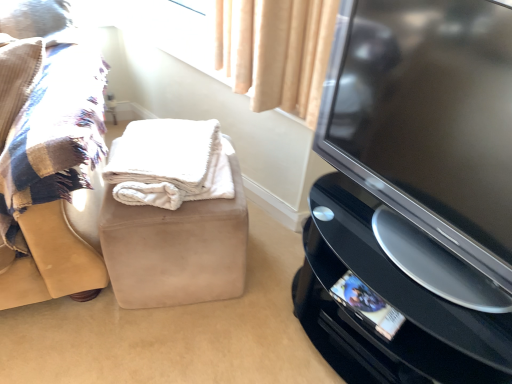
What is the approximate height of plaid fabric cushion at left, which ranks as the second furniture in right-to-left order?

It is 21.72 inches.

This screenshot has width=512, height=384. Describe the element at coordinates (173, 215) in the screenshot. I see `beige suede ottoman at center, which ranks as the 1th furniture in right-to-left order` at that location.

Locate an element on the screen. black glossy tv at right is located at coordinates (429, 136).

Locate an element on the screen. white fluffy blanket at center is located at coordinates (169, 163).

Locate an element on the screen. plaid fabric cushion at left, which ranks as the second furniture in right-to-left order is located at coordinates (47, 152).

Considering the sizes of objects beige suede ottoman at center, which ranks as the 1th furniture in right-to-left order, and plaid fabric cushion at left, which ranks as the second furniture in right-to-left order, in the image provided, who is shorter, beige suede ottoman at center, which ranks as the 1th furniture in right-to-left order, or plaid fabric cushion at left, which ranks as the second furniture in right-to-left order,?

beige suede ottoman at center, which ranks as the 1th furniture in right-to-left order.

Which is correct: beige suede ottoman at center, which ranks as the 1th furniture in right-to-left order, is inside plaid fabric cushion at left, arranged as the first furniture when viewed from the left, or outside of it?

beige suede ottoman at center, which ranks as the 1th furniture in right-to-left order, is outside plaid fabric cushion at left, arranged as the first furniture when viewed from the left.

Could you tell me if beige suede ottoman at center, positioned as the second furniture in left-to-right order, is facing plaid fabric cushion at left, arranged as the first furniture when viewed from the left?

No.

Who is smaller, beige suede ottoman at center, which ranks as the 1th furniture in right-to-left order, or plaid fabric cushion at left, which ranks as the second furniture in right-to-left order?

With smaller size is plaid fabric cushion at left, which ranks as the second furniture in right-to-left order.

Relative to black glossy tv at right, is beige suede ottoman at center, positioned as the second furniture in left-to-right order, in front or behind?

Visually, beige suede ottoman at center, positioned as the second furniture in left-to-right order, is located behind black glossy tv at right.

Is beige suede ottoman at center, positioned as the second furniture in left-to-right order, shorter than black glossy tv at right?

Correct, beige suede ottoman at center, positioned as the second furniture in left-to-right order, is not as tall as black glossy tv at right.

Does beige suede ottoman at center, which ranks as the 1th furniture in right-to-left order, have a lesser width compared to black glossy tv at right?

Indeed, beige suede ottoman at center, which ranks as the 1th furniture in right-to-left order, has a lesser width compared to black glossy tv at right.

Which object is positioned more to the right, black glossy tv at right or beige suede ottoman at center, which ranks as the 1th furniture in right-to-left order?

Positioned to the right is black glossy tv at right.

From a real-world perspective, is black glossy tv at right above or below beige suede ottoman at center, positioned as the second furniture in left-to-right order?

Clearly, from a real-world perspective, black glossy tv at right is above beige suede ottoman at center, positioned as the second furniture in left-to-right order.

Does black glossy tv at right have a smaller size compared to beige suede ottoman at center, positioned as the second furniture in left-to-right order?

No.

This screenshot has width=512, height=384. I want to click on the 2nd furniture behind when counting from the black glossy tv at right, so click(x=173, y=215).

In terms of height, does plaid fabric cushion at left, which ranks as the second furniture in right-to-left order, look taller or shorter compared to black glossy tv at right?

Clearly, plaid fabric cushion at left, which ranks as the second furniture in right-to-left order, is shorter compared to black glossy tv at right.

Do you think plaid fabric cushion at left, arranged as the first furniture when viewed from the left, is within black glossy tv at right, or outside of it?

plaid fabric cushion at left, arranged as the first furniture when viewed from the left, lies outside black glossy tv at right.

Find the location of a particular element. furniture that is the 1st one when counting backward from the black glossy tv at right is located at coordinates 47,152.

Does plaid fabric cushion at left, arranged as the first furniture when viewed from the left, appear on the right side of black glossy tv at right?

Incorrect, plaid fabric cushion at left, arranged as the first furniture when viewed from the left, is not on the right side of black glossy tv at right.

Which is in front, white fluffy blanket at center or plaid fabric cushion at left, which ranks as the second furniture in right-to-left order?

plaid fabric cushion at left, which ranks as the second furniture in right-to-left order, is in front.

Can you confirm if white fluffy blanket at center is smaller than plaid fabric cushion at left, which ranks as the second furniture in right-to-left order?

Yes.

Find the location of a particular element. This screenshot has height=384, width=512. blanket behind the plaid fabric cushion at left, arranged as the first furniture when viewed from the left is located at coordinates (169, 163).

Is white fluffy blanket at center positioned far away from plaid fabric cushion at left, arranged as the first furniture when viewed from the left?

No.

From the image's perspective, is black glossy tv at right below plaid fabric cushion at left, which ranks as the second furniture in right-to-left order?

Yes.

Is black glossy tv at right not near plaid fabric cushion at left, which ranks as the second furniture in right-to-left order?

No.

In the image, is black glossy tv at right on the left side or the right side of plaid fabric cushion at left, which ranks as the second furniture in right-to-left order?

From the image, it's evident that black glossy tv at right is to the right of plaid fabric cushion at left, which ranks as the second furniture in right-to-left order.

Is black glossy tv at right not within plaid fabric cushion at left, arranged as the first furniture when viewed from the left?

Absolutely, black glossy tv at right is external to plaid fabric cushion at left, arranged as the first furniture when viewed from the left.

From the image's perspective, is black glossy tv at right above plaid fabric cushion at left, arranged as the first furniture when viewed from the left?

No.

Is black glossy tv at right far from plaid fabric cushion at left, which ranks as the second furniture in right-to-left order?

That's not correct — black glossy tv at right is a little close to plaid fabric cushion at left, which ranks as the second furniture in right-to-left order.

Is black glossy tv at right to the left or to the right of plaid fabric cushion at left, which ranks as the second furniture in right-to-left order, in the image?

Clearly, black glossy tv at right is on the right of plaid fabric cushion at left, which ranks as the second furniture in right-to-left order, in the image.

Which of these two, black glossy tv at right or plaid fabric cushion at left, arranged as the first furniture when viewed from the left, is bigger?

black glossy tv at right.

In order to click on furniture located above the beige suede ottoman at center, positioned as the second furniture in left-to-right order (from the image's perspective) in this screenshot , I will do `click(47, 152)`.

You are a GUI agent. You are given a task and a screenshot of the screen. Output one action in this format:
    pyautogui.click(x=<x>, y=<y>)
    Task: Click on the home appliance located in front of the beige suede ottoman at center, which ranks as the 1th furniture in right-to-left order
    
    Given the screenshot: What is the action you would take?
    pyautogui.click(x=385, y=305)

Looking at the image, which one is located closer to beige suede ottoman at center, positioned as the second furniture in left-to-right order, white fluffy blanket at center or plaid fabric cushion at left, arranged as the first furniture when viewed from the left?

white fluffy blanket at center lies closer to beige suede ottoman at center, positioned as the second furniture in left-to-right order, than the other object.

Estimate the real-world distances between objects in this image. Which object is further from white fluffy blanket at center, beige suede ottoman at center, positioned as the second furniture in left-to-right order, or black glossy tv at right?

The object further to white fluffy blanket at center is black glossy tv at right.

Considering their positions, is plaid fabric cushion at left, which ranks as the second furniture in right-to-left order, positioned closer to white fluffy blanket at center than black glossy tv at right?

plaid fabric cushion at left, which ranks as the second furniture in right-to-left order, is positioned closer to the anchor white fluffy blanket at center.

Estimate the real-world distances between objects in this image. Which object is closer to plaid fabric cushion at left, arranged as the first furniture when viewed from the left, black glossy tv at right or white fluffy blanket at center?

white fluffy blanket at center is closer to plaid fabric cushion at left, arranged as the first furniture when viewed from the left.

Looking at the image, which one is located further to black glossy tv at right, white fluffy blanket at center or black glossy tv at right?

white fluffy blanket at center lies further to black glossy tv at right than the other object.

Which object lies further to the anchor point black glossy tv at right, black glossy tv at right or beige suede ottoman at center, positioned as the second furniture in left-to-right order?

beige suede ottoman at center, positioned as the second furniture in left-to-right order.

Estimate the real-world distances between objects in this image. Which object is further from beige suede ottoman at center, which ranks as the 1th furniture in right-to-left order, plaid fabric cushion at left, which ranks as the second furniture in right-to-left order, or black glossy tv at right?

The object further to beige suede ottoman at center, which ranks as the 1th furniture in right-to-left order, is black glossy tv at right.

Which object lies further to the anchor point black glossy tv at right, white fluffy blanket at center or beige suede ottoman at center, positioned as the second furniture in left-to-right order?

white fluffy blanket at center.

Image resolution: width=512 pixels, height=384 pixels. What are the coordinates of `furniture between plaid fabric cushion at left, which ranks as the second furniture in right-to-left order, and black glossy tv at right from left to right` in the screenshot? It's located at (173, 215).

You are a GUI agent. You are given a task and a screenshot of the screen. Output one action in this format:
    pyautogui.click(x=<x>, y=<y>)
    Task: Click on the furniture located between plaid fabric cushion at left, arranged as the first furniture when viewed from the left, and white fluffy blanket at center in the left-right direction
    This screenshot has height=384, width=512.
    Given the screenshot: What is the action you would take?
    pyautogui.click(x=173, y=215)

This screenshot has height=384, width=512. Identify the location of blanket between plaid fabric cushion at left, arranged as the first furniture when viewed from the left, and black glossy tv at right. (169, 163).

Find the location of `blanket situated between plaid fabric cushion at left, which ranks as the second furniture in right-to-left order, and black glossy tv at right from left to right`. blanket situated between plaid fabric cushion at left, which ranks as the second furniture in right-to-left order, and black glossy tv at right from left to right is located at coordinates (169, 163).